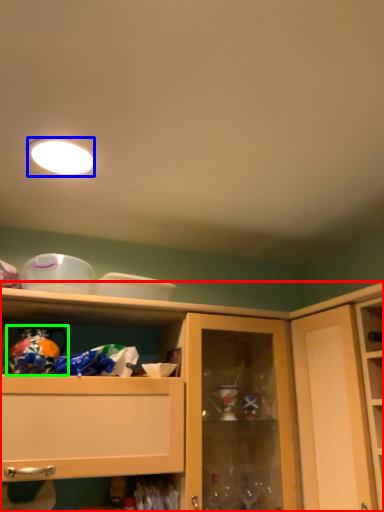
Question: Which object is the farthest from cabinetry (highlighted by a red box)? Choose among these: lighting (highlighted by a blue box) or toy (highlighted by a green box).

Choices:
 (A) lighting
 (B) toy

Answer: (A)